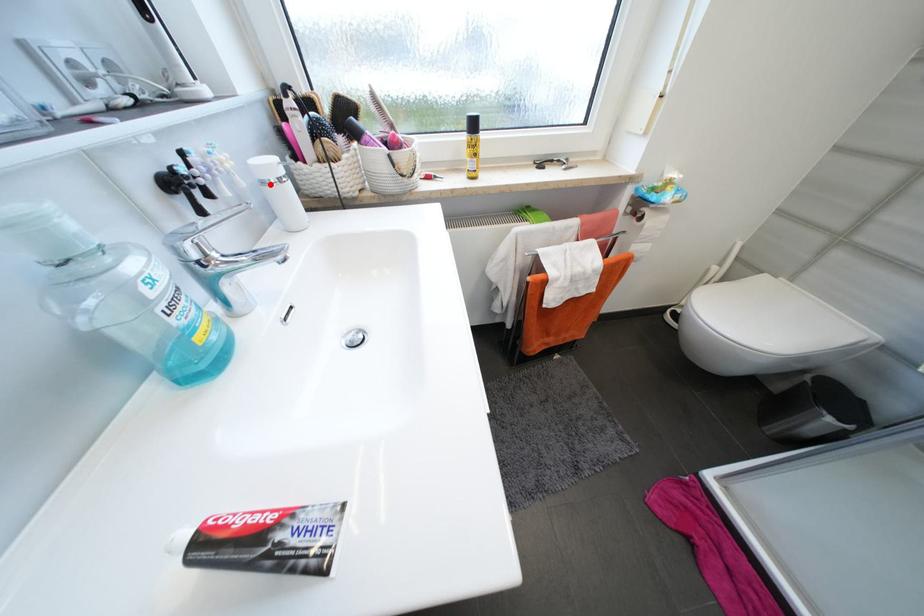
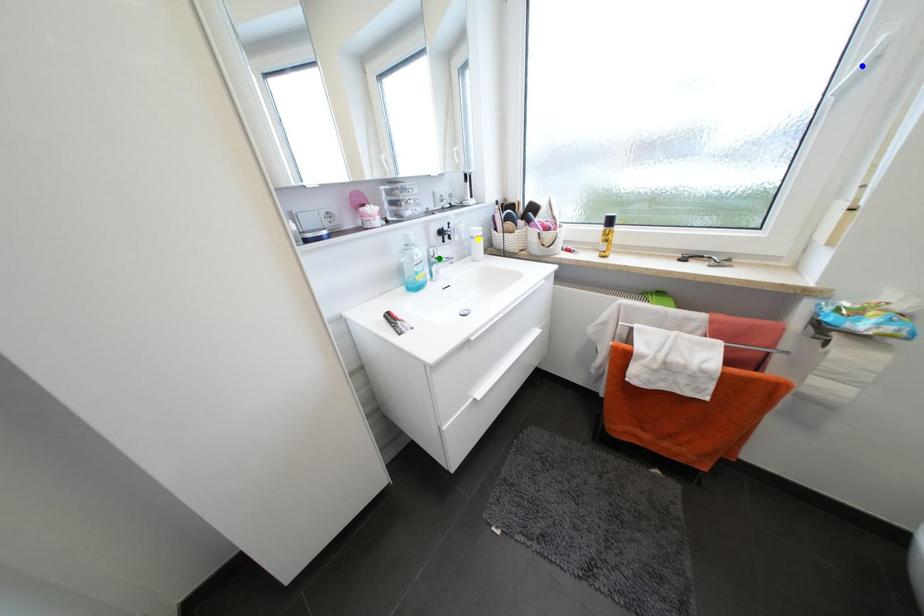
Question: I am providing you with two images of the same scene from different viewpoints. A red point is marked on the first image. You are given multiple points on the second image. In image 2, which mark is for the same physical point as the one in image 1?

Choices:
 (A) blue point
 (B) green point
 (C) yellow point

Answer: (C)